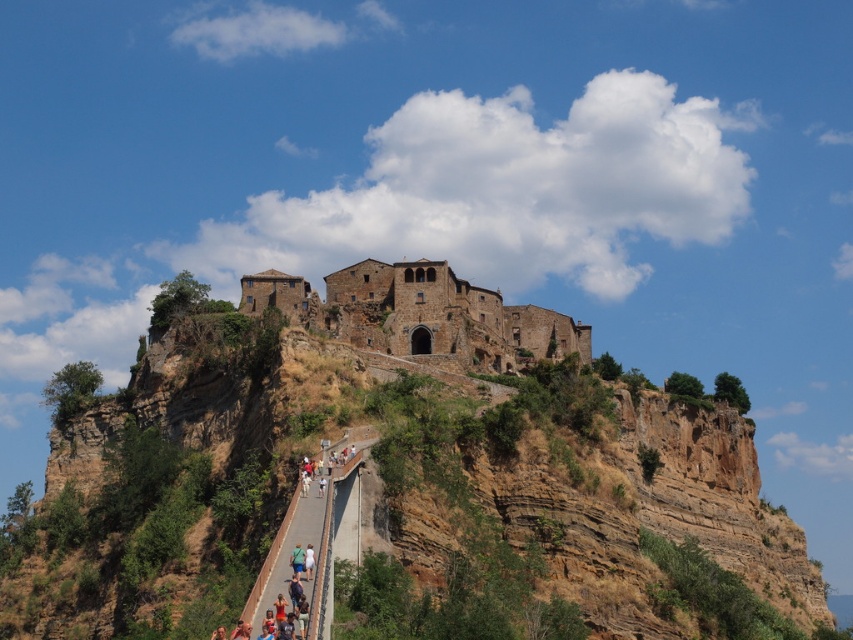
Question: Can you confirm if concrete walkway at center is positioned above green fabric person at lower center?

Choices:
 (A) no
 (B) yes

Answer: (A)

Question: Which object is farther from the camera taking this photo?

Choices:
 (A) concrete walkway at center
 (B) brown rocky cliff at upper center

Answer: (B)

Question: Based on their relative distances, which object is farther from the brown rocky cliff at upper center?

Choices:
 (A) brown stone building at center
 (B) light blue denim shorts at lower center
 (C) green fabric person at lower center
 (D) concrete walkway at center

Answer: (B)

Question: Which of these objects is positioned closest to the light blue denim shorts at lower center?

Choices:
 (A) brown rocky cliff at upper center
 (B) concrete walkway at center
 (C) brown stone building at center

Answer: (B)

Question: Can you confirm if brown rocky cliff at upper center is bigger than light blue denim shorts at lower center?

Choices:
 (A) yes
 (B) no

Answer: (A)

Question: Is brown rocky cliff at upper center above concrete walkway at center?

Choices:
 (A) yes
 (B) no

Answer: (B)